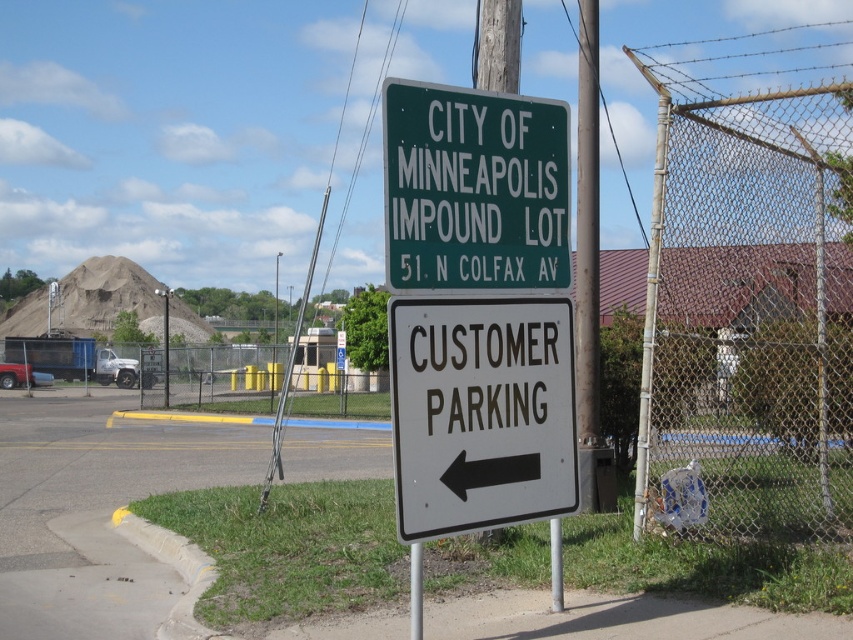
Is wire mesh fence at right closer to camera compared to white plastic sign at center?

No.

Looking at this image, can you confirm if wire mesh fence at right is shorter than white plastic sign at center?

Incorrect, wire mesh fence at right's height does not fall short of white plastic sign at center's.

Is point (740, 246) farther from viewer compared to point (477, 522)?

Yes, it is behind point (477, 522).

You are a GUI agent. You are given a task and a screenshot of the screen. Output one action in this format:
    pyautogui.click(x=<x>, y=<y>)
    Task: Click on the wire mesh fence at right
    
    Given the screenshot: What is the action you would take?
    coord(750,308)

Does wire mesh fence at right appear on the right side of green metal sign at upper center?

Correct, you'll find wire mesh fence at right to the right of green metal sign at upper center.

Is wire mesh fence at right positioned behind green metal sign at upper center?

Yes, it is behind green metal sign at upper center.

Is point (660, 328) farther from viewer compared to point (440, 216)?

Yes, point (660, 328) is behind point (440, 216).

The width and height of the screenshot is (853, 640). In order to click on wire mesh fence at right in this screenshot , I will do `click(750, 308)`.

Is white plastic sign at center in front of green metal sign at upper center?

Yes, it is in front of green metal sign at upper center.

Identify the location of white plastic sign at center. The width and height of the screenshot is (853, 640). (480, 413).